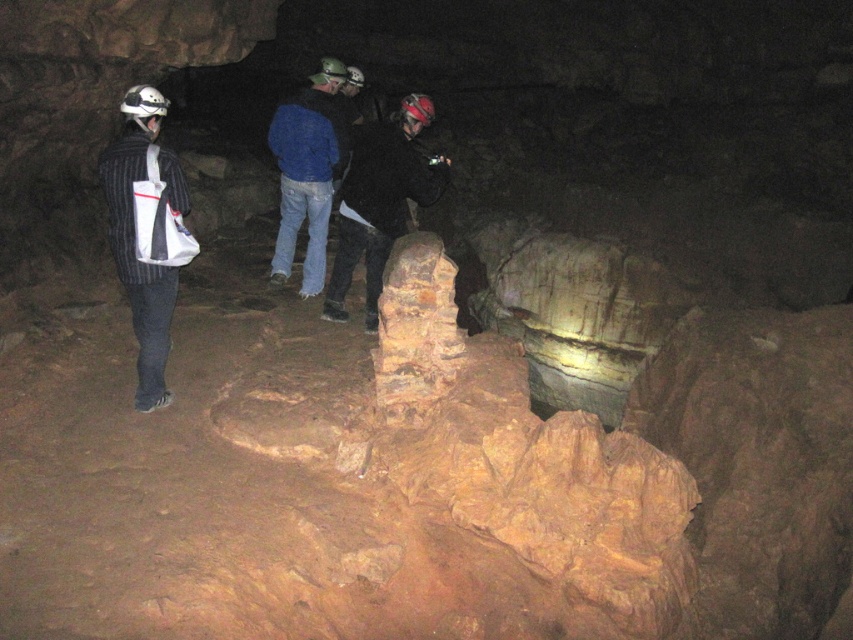
Question: Considering the relative positions of striped fabric backpack at left and blue denim jeans at center in the image provided, where is striped fabric backpack at left located with respect to blue denim jeans at center?

Choices:
 (A) left
 (B) right

Answer: (A)

Question: Which of the following is the farthest from the observer?

Choices:
 (A) striped fabric backpack at left
 (B) dark matte jacket at center

Answer: (B)

Question: Which point appears closest to the camera in this image?

Choices:
 (A) (363, 248)
 (B) (321, 109)
 (C) (148, 308)

Answer: (C)

Question: Is striped fabric backpack at left bigger than dark matte jacket at center?

Choices:
 (A) no
 (B) yes

Answer: (A)

Question: Among these points, which one is nearest to the camera?

Choices:
 (A) (367, 260)
 (B) (283, 132)
 (C) (161, 369)

Answer: (C)

Question: Where is dark matte jacket at center located in relation to blue denim jeans at center in the image?

Choices:
 (A) left
 (B) right

Answer: (B)